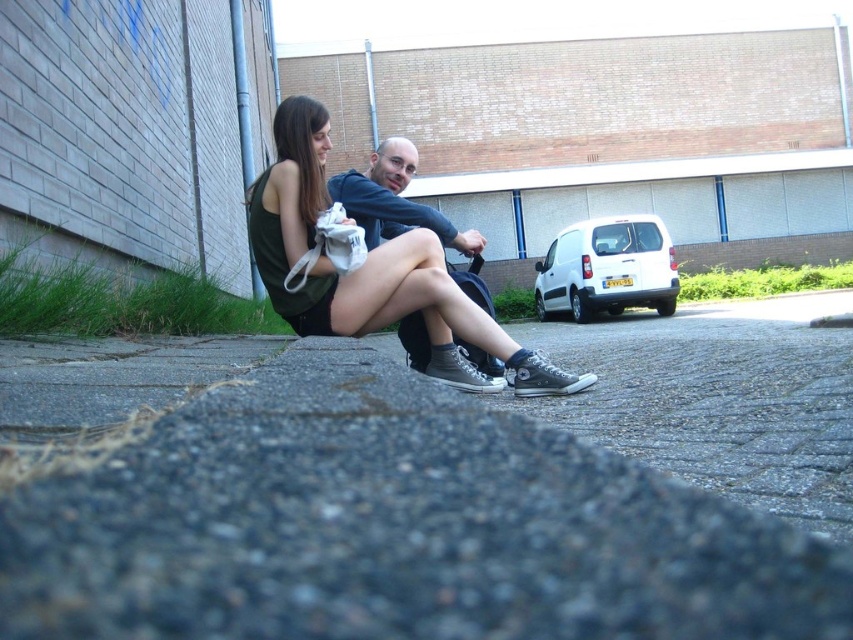
Who is more distant from viewer, (277, 129) or (340, 173)?

The point (340, 173) is behind.

Consider the image. Is matte black sneakers at center shorter than matte black hoodie at center?

Incorrect, matte black sneakers at center's height does not fall short of matte black hoodie at center's.

Is point (503, 352) in front of point (397, 227)?

Yes, point (503, 352) is closer to viewer.

This screenshot has width=853, height=640. I want to click on matte black sneakers at center, so click(370, 269).

Is white matte van at upper right bigger than matte black hoodie at center?

Yes, white matte van at upper right is bigger than matte black hoodie at center.

Between white matte van at upper right and matte black hoodie at center, which one has less height?

matte black hoodie at center is shorter.

Identify the location of white matte van at upper right. Image resolution: width=853 pixels, height=640 pixels. (607, 268).

Who is shorter, matte black sneakers at center or white matte van at upper right?

matte black sneakers at center

Does matte black sneakers at center have a greater height compared to white matte van at upper right?

Incorrect, matte black sneakers at center's height is not larger of white matte van at upper right's.

You are a GUI agent. You are given a task and a screenshot of the screen. Output one action in this format:
    pyautogui.click(x=<x>, y=<y>)
    Task: Click on the matte black sneakers at center
    The height and width of the screenshot is (640, 853).
    Given the screenshot: What is the action you would take?
    pyautogui.click(x=370, y=269)

Find the location of a particular element. The width and height of the screenshot is (853, 640). matte black sneakers at center is located at coordinates (370, 269).